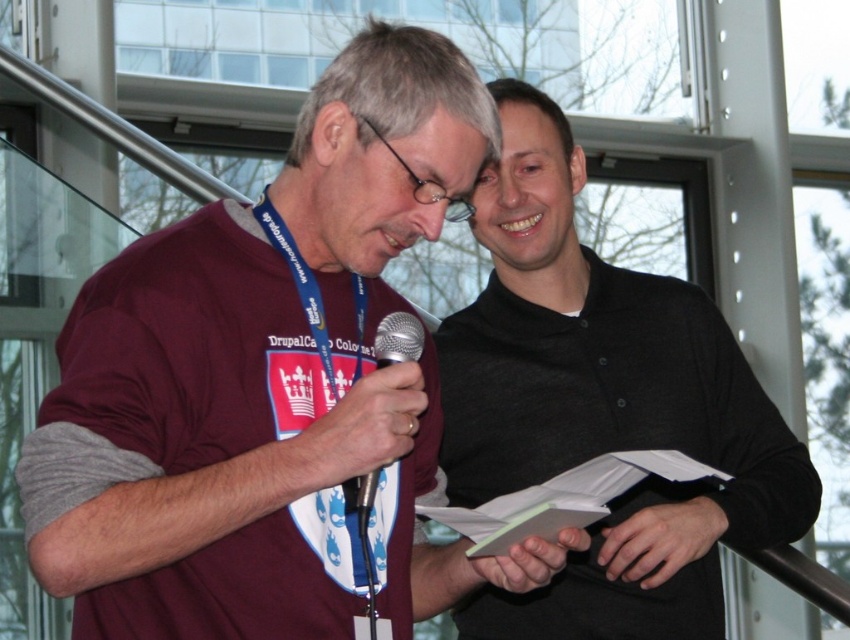
You are at an event and need to hand over the metallic silver microphone at center to someone. To do so, you first need to locate it relative to the blue fabric lanyard at center. Where is the microphone positioned compared to the lanyard?

The metallic silver microphone at center is positioned below the blue fabric lanyard at center.

You are an event organizer at the DrupalCamp Cologne conference. You need to ensure that all participants can see the speaker clearly. The blue fabric lanyard at center and the metallic silver microphone at center are both in the speaker s line of sight. Which object is taller and might block the speaker s view?

The blue fabric lanyard at center is taller than the metallic silver microphone at center, so it might block the speaker s view.